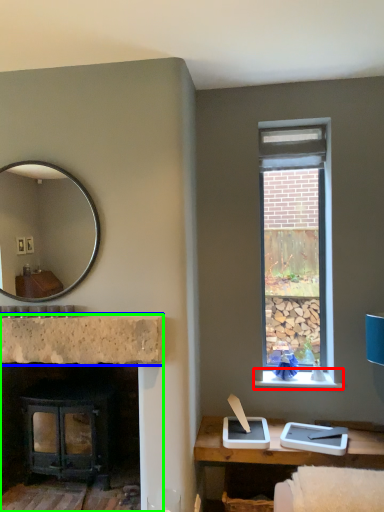
Question: Estimate the real-world distances between objects in this image. Which object is closer to window sill (highlighted by a red box), counter top (highlighted by a blue box) or fireplace (highlighted by a green box)?

Choices:
 (A) counter top
 (B) fireplace

Answer: (A)